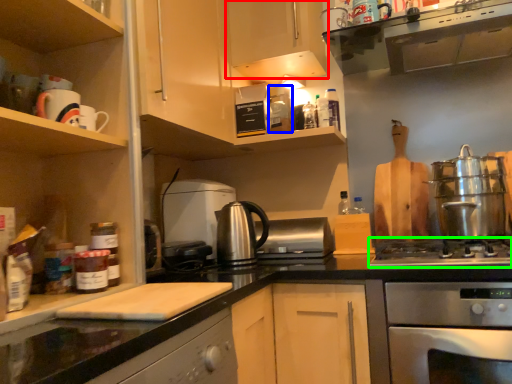
Question: Considering the real-world distances, which object is farthest from cabinetry (highlighted by a red box)? appliance (highlighted by a blue box) or gas stove (highlighted by a green box)?

Choices:
 (A) appliance
 (B) gas stove

Answer: (B)